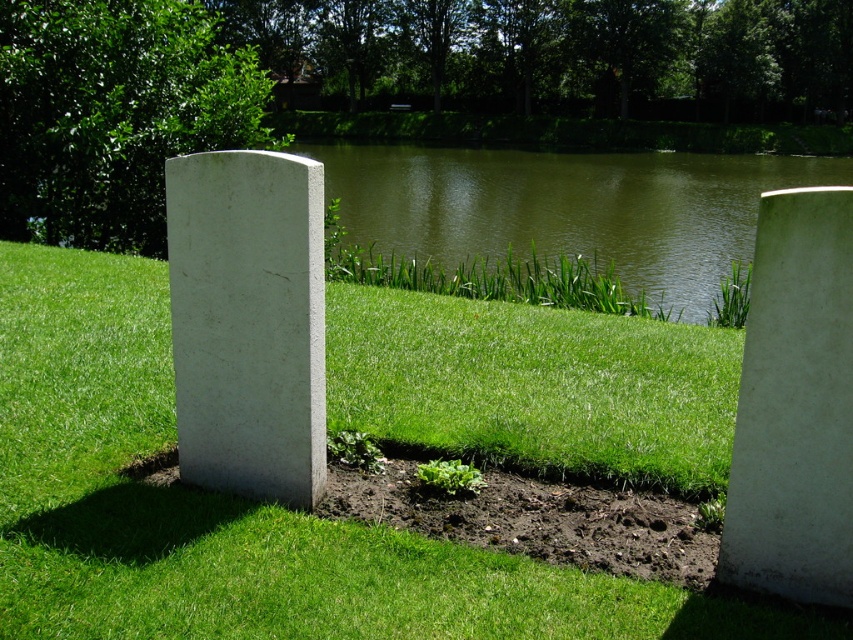
Can you confirm if green water at center is smaller than white concrete at right?

Incorrect, green water at center is not smaller in size than white concrete at right.

Can you confirm if green water at center is shorter than white concrete at right?

No.

Who is more forward, (671, 179) or (788, 380)?

Point (788, 380) is more forward.

At what (x,y) coordinates should I click in order to perform the action: click on green water at center. Please return your answer as a coordinate pair (x, y). Image resolution: width=853 pixels, height=640 pixels. Looking at the image, I should click on (567, 205).

Is green grassy at center to the left of green water at center from the viewer's perspective?

Correct, you'll find green grassy at center to the left of green water at center.

Who is more distant from viewer, (85, 433) or (412, 244)?

Positioned behind is point (412, 244).

Identify the location of green grassy at center. The width and height of the screenshot is (853, 640). (239, 509).

Does green grassy at center appear over white marble gravestone at center?

No, green grassy at center is not above white marble gravestone at center.

The width and height of the screenshot is (853, 640). What are the coordinates of `green grassy at center` in the screenshot? It's located at (239, 509).

Identify the location of green grassy at center. (239, 509).